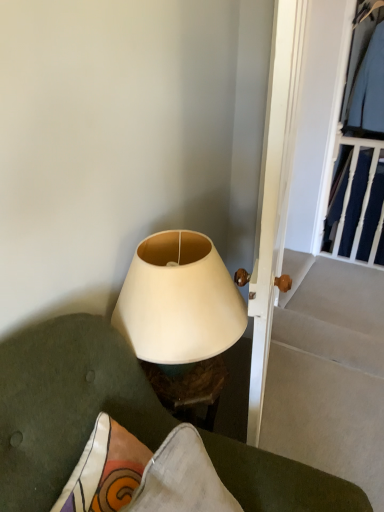
What do you see at coordinates (273, 193) in the screenshot? I see `white wooden door at center` at bounding box center [273, 193].

The width and height of the screenshot is (384, 512). Describe the element at coordinates (359, 204) in the screenshot. I see `dark blue fabric at upper right, positioned as the first clothing in bottom-to-top order` at that location.

The image size is (384, 512). Find the location of `matte white lampshade at center`. matte white lampshade at center is located at coordinates (66, 404).

The width and height of the screenshot is (384, 512). I want to click on white wooden door at center, so click(273, 193).

Considering the sizes of objects white matte lampshade at center and light blue fabric shirt at upper right, arranged as the second clothing when ordered from the bottom, in the image provided, who is taller, white matte lampshade at center or light blue fabric shirt at upper right, arranged as the second clothing when ordered from the bottom,?

light blue fabric shirt at upper right, arranged as the second clothing when ordered from the bottom.

Considering the relative positions of white matte lampshade at center and light blue fabric shirt at upper right, arranged as the second clothing when ordered from the bottom, in the image provided, is white matte lampshade at center to the right of light blue fabric shirt at upper right, arranged as the second clothing when ordered from the bottom, from the viewer's perspective?

Incorrect, white matte lampshade at center is not on the right side of light blue fabric shirt at upper right, arranged as the second clothing when ordered from the bottom.

Locate an element on the screen. lamp located in front of the light blue fabric shirt at upper right, arranged as the second clothing when ordered from the bottom is located at coordinates (181, 318).

Is matte white lampshade at center positioned with its back to dark blue fabric at upper right, positioned as the first clothing in bottom-to-top order?

No, matte white lampshade at center is not facing the opposite direction of dark blue fabric at upper right, positioned as the first clothing in bottom-to-top order.

Find the location of a particular element. The width and height of the screenshot is (384, 512). furniture below the dark blue fabric at upper right, positioned as the first clothing in bottom-to-top order (from the image's perspective) is located at coordinates (66, 404).

Looking at the image, does matte white lampshade at center seem bigger or smaller compared to dark blue fabric at upper right, positioned as the first clothing in bottom-to-top order?

Clearly, matte white lampshade at center is larger in size than dark blue fabric at upper right, positioned as the first clothing in bottom-to-top order.

Considering their positions, is matte white lampshade at center located in front of or behind dark blue fabric at upper right, the second clothing from the top?

Clearly, matte white lampshade at center is in front of dark blue fabric at upper right, the second clothing from the top.

You are a GUI agent. You are given a task and a screenshot of the screen. Output one action in this format:
    pyautogui.click(x=<x>, y=<y>)
    Task: Click on the clothing that appears below the white wooden door at center (from a real-world perspective)
    
    Given the screenshot: What is the action you would take?
    pyautogui.click(x=359, y=204)

Is white wooden door at center aimed at dark blue fabric at upper right, the second clothing from the top?

No, white wooden door at center is not aimed at dark blue fabric at upper right, the second clothing from the top.

Is white wooden door at center to the right of dark blue fabric at upper right, the second clothing from the top, from the viewer's perspective?

Incorrect, white wooden door at center is not on the right side of dark blue fabric at upper right, the second clothing from the top.

Looking at this image, from a real-world perspective, which is physically above, white wooden door at center or dark blue fabric at upper right, the second clothing from the top?

white wooden door at center.

Is point (354, 219) closer or farther from the camera than point (370, 50)?

Point (354, 219) is farther from the camera than point (370, 50).

Who is taller, dark blue fabric at upper right, positioned as the first clothing in bottom-to-top order, or light blue fabric shirt at upper right, arranged as the second clothing when ordered from the bottom?

dark blue fabric at upper right, positioned as the first clothing in bottom-to-top order.

Which object is closer to the camera, dark blue fabric at upper right, the second clothing from the top, or light blue fabric shirt at upper right, which ranks as the 1th clothing in top-to-bottom order?

Positioned in front is light blue fabric shirt at upper right, which ranks as the 1th clothing in top-to-bottom order.

Is dark blue fabric at upper right, the second clothing from the top, turned away from light blue fabric shirt at upper right, which ranks as the 1th clothing in top-to-bottom order?

No, light blue fabric shirt at upper right, which ranks as the 1th clothing in top-to-bottom order, is not at the back of dark blue fabric at upper right, the second clothing from the top.

Is white wooden door at center turned away from white matte lampshade at center?

Yes, white wooden door at center is facing away from white matte lampshade at center.

Locate an element on the screen. The height and width of the screenshot is (512, 384). door above the white matte lampshade at center (from the image's perspective) is located at coordinates (273, 193).

From the image's perspective, which one is positioned higher, white wooden door at center or white matte lampshade at center?

white wooden door at center, from the image's perspective.

From a real-world perspective, which object rests below the other?

white matte lampshade at center is physically lower.

Does point (275, 297) come closer to viewer compared to point (12, 422)?

No, (275, 297) is behind (12, 422).

Which object is further away from the camera, white wooden door at center or matte white lampshade at center?

white wooden door at center is behind.

From a real-world perspective, between white wooden door at center and matte white lampshade at center, who is vertically lower?

matte white lampshade at center is physically lower.

Is white wooden door at center not close to matte white lampshade at center?

No, white wooden door at center is not far away from matte white lampshade at center.

Considering the relative sizes of white matte lampshade at center and dark blue fabric at upper right, positioned as the first clothing in bottom-to-top order, in the image provided, is white matte lampshade at center bigger than dark blue fabric at upper right, positioned as the first clothing in bottom-to-top order,?

Yes.

From the image's perspective, which is above, white matte lampshade at center or dark blue fabric at upper right, the second clothing from the top?

dark blue fabric at upper right, the second clothing from the top, from the image's perspective.

Is point (135, 285) behind point (371, 242)?

No, it is not.

Considering the relative sizes of white matte lampshade at center and dark blue fabric at upper right, positioned as the first clothing in bottom-to-top order, in the image provided, is white matte lampshade at center wider than dark blue fabric at upper right, positioned as the first clothing in bottom-to-top order,?

Correct, the width of white matte lampshade at center exceeds that of dark blue fabric at upper right, positioned as the first clothing in bottom-to-top order.

What are the coordinates of `clothing above the white matte lampshade at center (from a real-world perspective)` in the screenshot? It's located at (369, 87).

In order to click on furniture below the dark blue fabric at upper right, positioned as the first clothing in bottom-to-top order (from the image's perspective) in this screenshot , I will do `click(66, 404)`.

Based on their spatial positions, is light blue fabric shirt at upper right, which ranks as the 1th clothing in top-to-bottom order, or dark blue fabric at upper right, positioned as the first clothing in bottom-to-top order, further from white wooden door at center?

light blue fabric shirt at upper right, which ranks as the 1th clothing in top-to-bottom order.

Looking at the image, which one is located further to matte white lampshade at center, light blue fabric shirt at upper right, which ranks as the 1th clothing in top-to-bottom order, or dark blue fabric at upper right, positioned as the first clothing in bottom-to-top order?

light blue fabric shirt at upper right, which ranks as the 1th clothing in top-to-bottom order, lies further to matte white lampshade at center than the other object.

Considering their positions, is dark blue fabric at upper right, the second clothing from the top, positioned further to light blue fabric shirt at upper right, arranged as the second clothing when ordered from the bottom, than white matte lampshade at center?

white matte lampshade at center lies further to light blue fabric shirt at upper right, arranged as the second clothing when ordered from the bottom, than the other object.

Based on their spatial positions, is matte white lampshade at center or white matte lampshade at center further from dark blue fabric at upper right, positioned as the first clothing in bottom-to-top order?

The object further to dark blue fabric at upper right, positioned as the first clothing in bottom-to-top order, is matte white lampshade at center.

Considering their positions, is dark blue fabric at upper right, the second clothing from the top, positioned closer to light blue fabric shirt at upper right, arranged as the second clothing when ordered from the bottom, than white wooden door at center?

dark blue fabric at upper right, the second clothing from the top, lies closer to light blue fabric shirt at upper right, arranged as the second clothing when ordered from the bottom, than the other object.

Estimate the real-world distances between objects in this image. Which object is closer to light blue fabric shirt at upper right, which ranks as the 1th clothing in top-to-bottom order, white matte lampshade at center or dark blue fabric at upper right, positioned as the first clothing in bottom-to-top order?

Based on the image, dark blue fabric at upper right, positioned as the first clothing in bottom-to-top order, appears to be nearer to light blue fabric shirt at upper right, which ranks as the 1th clothing in top-to-bottom order.

Considering their positions, is matte white lampshade at center positioned further to white matte lampshade at center than dark blue fabric at upper right, positioned as the first clothing in bottom-to-top order?

Among the two, dark blue fabric at upper right, positioned as the first clothing in bottom-to-top order, is located further to white matte lampshade at center.

Based on their spatial positions, is white matte lampshade at center or light blue fabric shirt at upper right, which ranks as the 1th clothing in top-to-bottom order, closer to dark blue fabric at upper right, positioned as the first clothing in bottom-to-top order?

light blue fabric shirt at upper right, which ranks as the 1th clothing in top-to-bottom order, is positioned closer to the anchor dark blue fabric at upper right, positioned as the first clothing in bottom-to-top order.

I want to click on lamp between white wooden door at center and dark blue fabric at upper right, positioned as the first clothing in bottom-to-top order, along the z-axis, so click(x=181, y=318).

You are a GUI agent. You are given a task and a screenshot of the screen. Output one action in this format:
    pyautogui.click(x=<x>, y=<y>)
    Task: Click on the clothing positioned between matte white lampshade at center and dark blue fabric at upper right, the second clothing from the top, from near to far
    The width and height of the screenshot is (384, 512).
    Given the screenshot: What is the action you would take?
    pyautogui.click(x=369, y=87)

At what (x,y) coordinates should I click in order to perform the action: click on door between matte white lampshade at center and dark blue fabric at upper right, the second clothing from the top, in the front-back direction. Please return your answer as a coordinate pair (x, y). The height and width of the screenshot is (512, 384). Looking at the image, I should click on (273, 193).

Identify the location of lamp that lies between white wooden door at center and matte white lampshade at center from top to bottom. (181, 318).